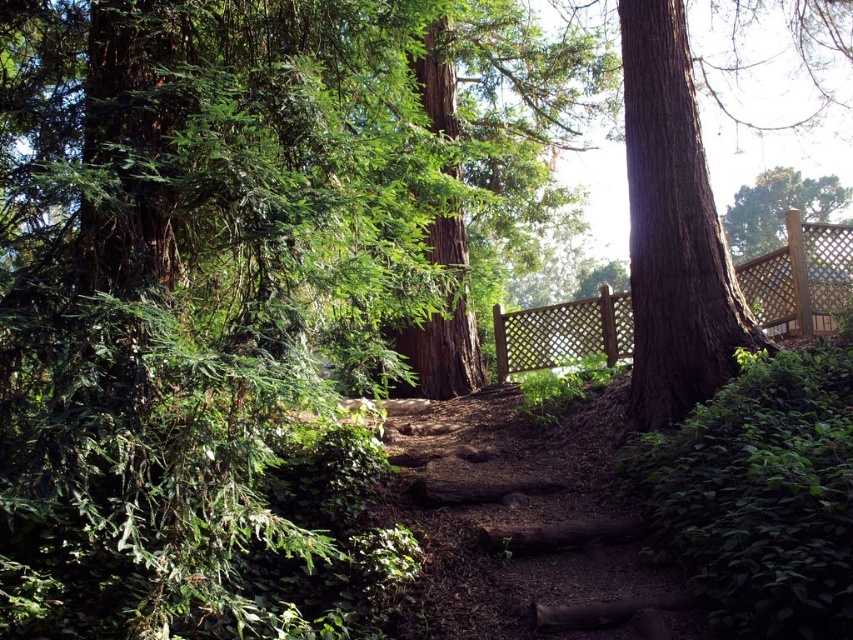
Question: Does smooth brown tree trunk at right appear on the left side of wooden lattice fence at right?

Choices:
 (A) yes
 (B) no

Answer: (B)

Question: Which point is farther from the camera taking this photo?

Choices:
 (A) (694, 166)
 (B) (836, 262)

Answer: (B)

Question: Does smooth brown tree trunk at right appear on the right side of wooden lattice fence at right?

Choices:
 (A) no
 (B) yes

Answer: (B)

Question: Which of the following is the closest to the observer?

Choices:
 (A) smooth brown tree trunk at right
 (B) wooden lattice fence at right

Answer: (A)

Question: Observing the image, what is the correct spatial positioning of smooth brown tree trunk at right in reference to wooden lattice fence at right?

Choices:
 (A) left
 (B) right

Answer: (B)

Question: Which point is farther to the camera?

Choices:
 (A) (775, 252)
 (B) (656, 20)

Answer: (A)